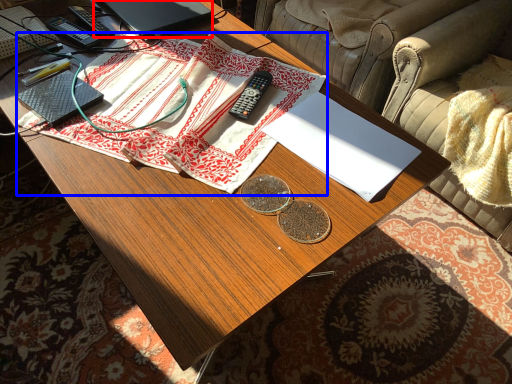
Question: Which object is further to the camera taking this photo, laptop (highlighted by a red box) or cloth (highlighted by a blue box)?

Choices:
 (A) laptop
 (B) cloth

Answer: (A)